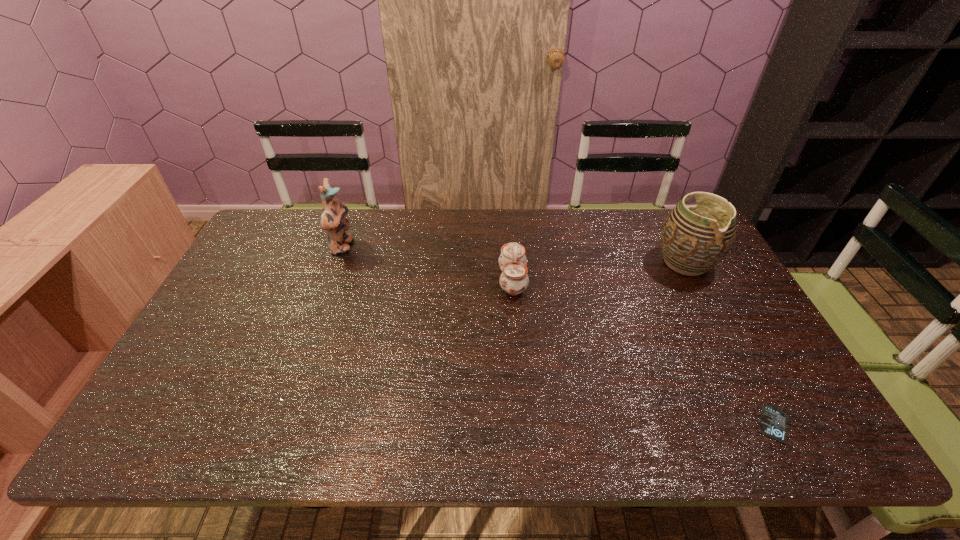
Find the location of a particular element. blank space at the near edge is located at coordinates click(532, 420).

Locate an element on the screen. free point at the left edge is located at coordinates (196, 340).

This screenshot has height=540, width=960. In the image, there is a desktop. Identify the location of free region at the right edge. (718, 336).

The height and width of the screenshot is (540, 960). What are the coordinates of `free space at the far left corner` in the screenshot? It's located at (256, 231).

The width and height of the screenshot is (960, 540). Identify the location of free space between the identity card and the figurine. (559, 336).

Identify the location of free space between the third tallest object and the pottery. Image resolution: width=960 pixels, height=540 pixels. (599, 272).

This screenshot has width=960, height=540. What are the coordinates of `empty space that is in between the leftmost object and the chinaware` in the screenshot? It's located at (427, 264).

Identify the location of free space between the chinaware and the identity card. (643, 353).

Identify the location of empty space that is in between the second object from left to right and the leftmost object. This screenshot has width=960, height=540. (427, 264).

Where is `vacant space that is in between the identity card and the leftmost object`? This screenshot has height=540, width=960. vacant space that is in between the identity card and the leftmost object is located at coordinates [x=559, y=336].